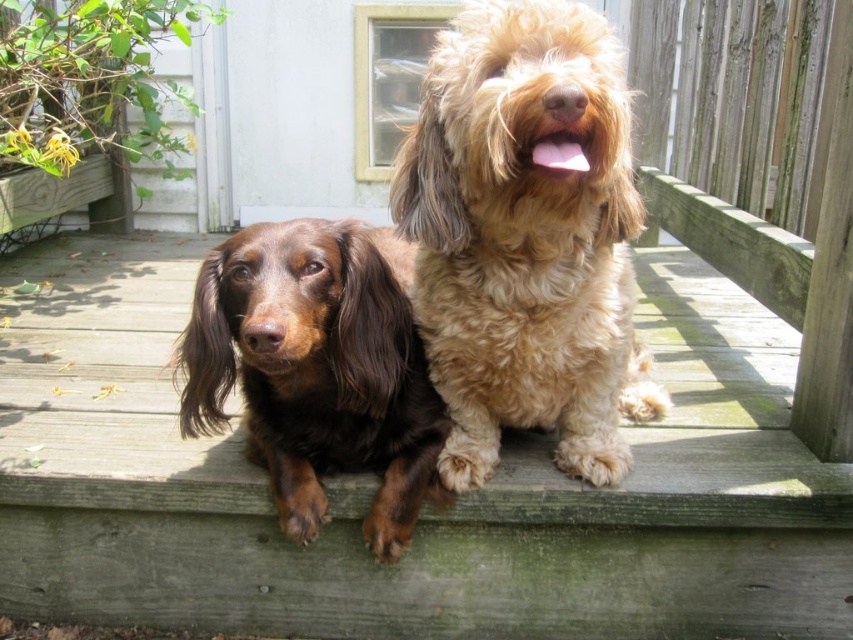
Can you confirm if wooden deck at center is taller than brown shaggy dog at left?

Correct, wooden deck at center is much taller as brown shaggy dog at left.

Looking at this image, is wooden deck at center closer to the viewer compared to brown shaggy dog at left?

No.

Is point (347, 531) behind point (370, 326)?

Yes, point (347, 531) is behind point (370, 326).

Identify the location of wooden deck at center. (424, 508).

Is wooden deck at center smaller than golden fluffy dog at center?

Actually, wooden deck at center might be larger than golden fluffy dog at center.

Does point (554, 570) come behind point (425, 316)?

Yes, point (554, 570) is farther from viewer.

Find the location of a particular element. wooden deck at center is located at coordinates pyautogui.click(x=424, y=508).

Is golden fluffy dog at center positioned behind brown shaggy dog at left?

No.

Is golden fluffy dog at center shorter than brown shaggy dog at left?

Incorrect, golden fluffy dog at center's height does not fall short of brown shaggy dog at left's.

Describe the element at coordinates (526, 236) in the screenshot. I see `golden fluffy dog at center` at that location.

Identify the location of golden fluffy dog at center. (526, 236).